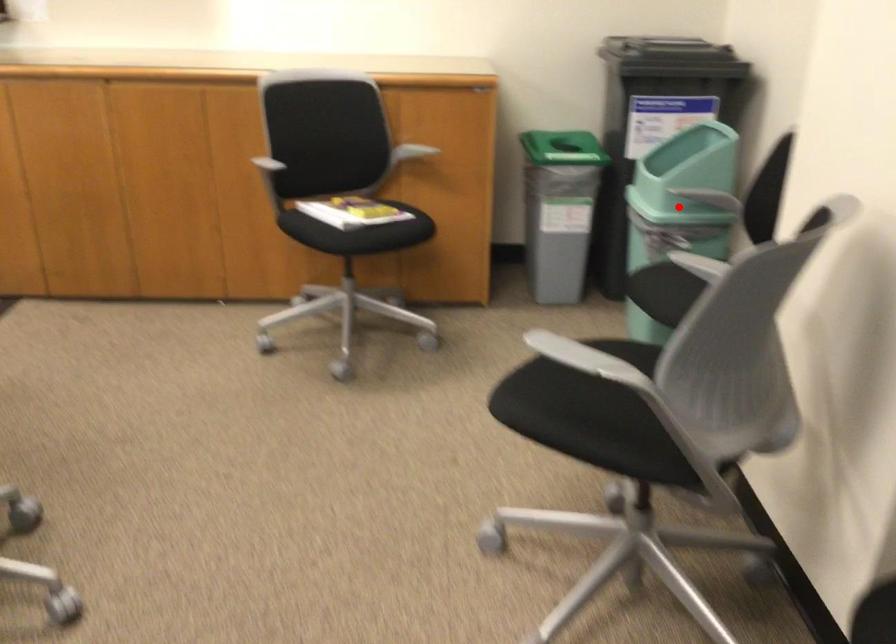
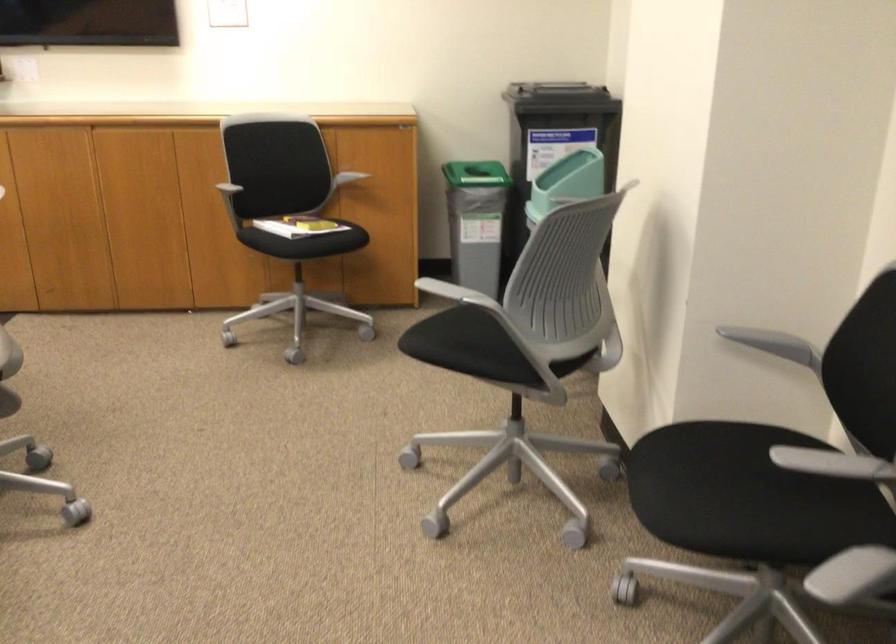
Question: I am providing you with two images of the same scene from different viewpoints. A red point is marked on the first image. Is the red point's position out of view in image 2?

Choices:
 (A) Yes
 (B) No

Answer: (A)